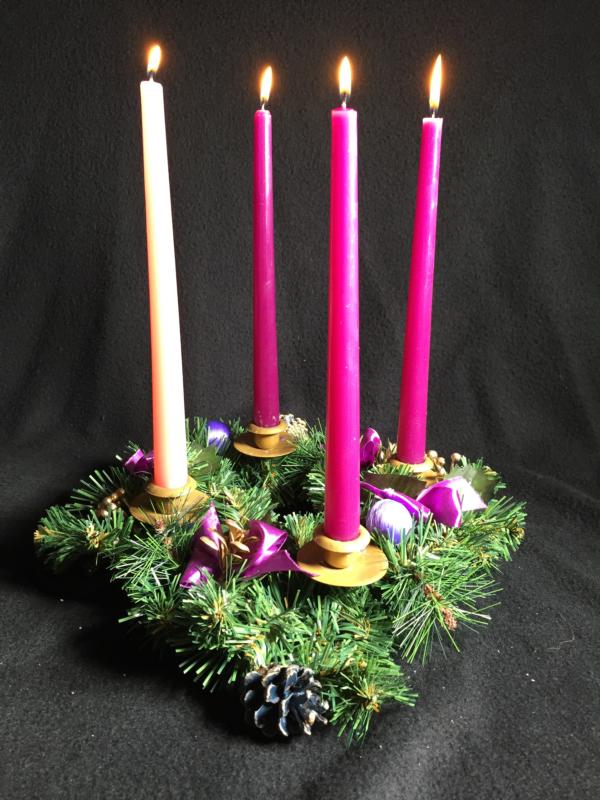
Image resolution: width=600 pixels, height=800 pixels. I want to click on backdrop, so click(470, 345).